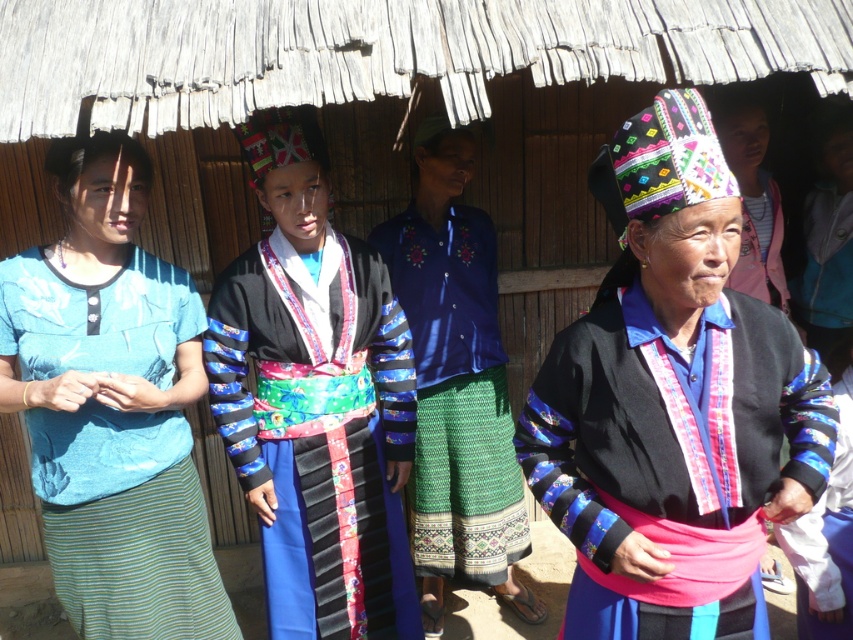
Question: Can you confirm if blue fabric shirt at left is thinner than pink fabric headband at upper right?

Choices:
 (A) no
 (B) yes

Answer: (A)

Question: Which point appears farthest from the camera in this image?

Choices:
 (A) (108, 275)
 (B) (287, 436)

Answer: (B)

Question: Is blue fabric shirt at center to the left of pink fabric headband at upper right from the viewer's perspective?

Choices:
 (A) no
 (B) yes

Answer: (B)

Question: Which point is farther from the camera taking this photo?

Choices:
 (A) (663, 504)
 (B) (775, 212)
 (C) (115, 614)
 (D) (293, 173)

Answer: (B)

Question: Which point is farther to the camera?

Choices:
 (A) [241, 317]
 (B) [827, 406]
 (C) [59, 573]

Answer: (A)

Question: Is matte black jacket at center thinner than matte black dress at center?

Choices:
 (A) yes
 (B) no

Answer: (B)